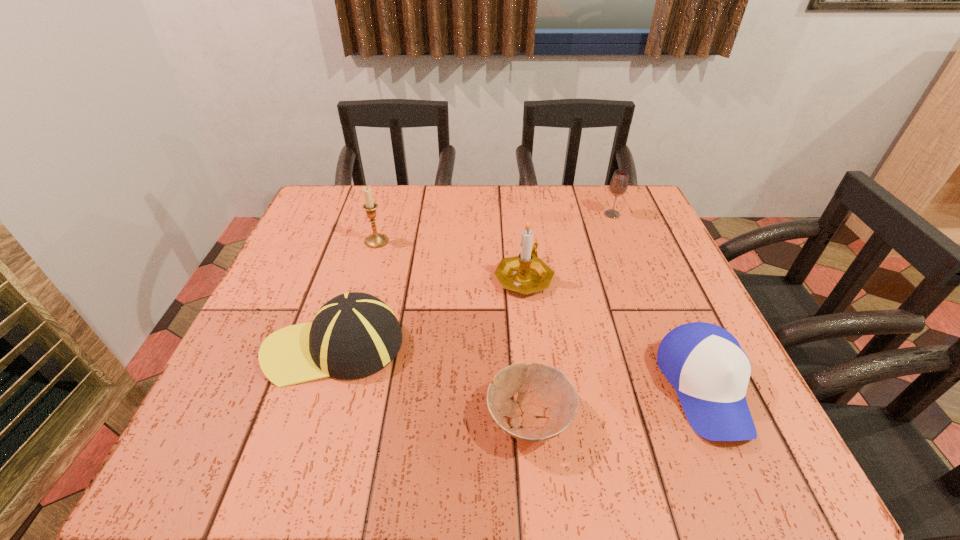
You are a GUI agent. You are given a task and a screenshot of the screen. Output one action in this format:
    pyautogui.click(x=<x>, y=<y>)
    Task: Click on the object positioned at the far right corner
    Image resolution: width=960 pixels, height=540 pixels.
    Given the screenshot: What is the action you would take?
    pyautogui.click(x=618, y=186)

The height and width of the screenshot is (540, 960). I want to click on object located in the near right corner section of the desktop, so click(x=710, y=372).

Locate an element on the screen. The height and width of the screenshot is (540, 960). vacant area at the far edge of the desktop is located at coordinates (436, 207).

What are the coordinates of `vacant space at the near edge of the desktop` in the screenshot? It's located at (403, 444).

In the image, there is a desktop. Identify the location of vacant space at the left edge. This screenshot has height=540, width=960. (281, 295).

Where is `free space at the far left corner of the desktop`? free space at the far left corner of the desktop is located at coordinates (342, 219).

You are a GUI agent. You are given a task and a screenshot of the screen. Output one action in this format:
    pyautogui.click(x=<x>, y=<y>)
    Task: Click on the vacant space at the far right corner
    
    Given the screenshot: What is the action you would take?
    pyautogui.click(x=623, y=232)

Find the location of a particular element. The image size is (960, 540). vacant area at the near right corner of the desktop is located at coordinates (723, 461).

Locate an element on the screen. Image resolution: width=960 pixels, height=540 pixels. free space between the farthest object and the shorter baseball cap is located at coordinates (658, 301).

The height and width of the screenshot is (540, 960). Identify the location of vacant area between the third farthest object and the left baseball cap. (429, 312).